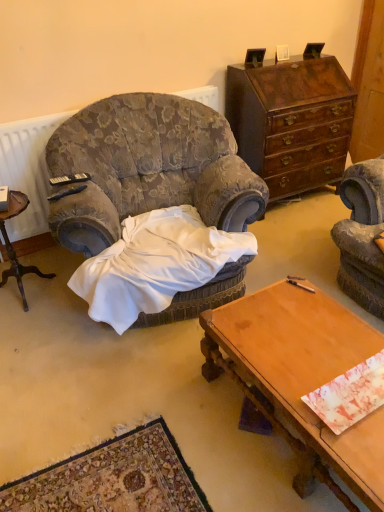
The image size is (384, 512). I want to click on free space in front of wooden nightstand at left, so click(28, 328).